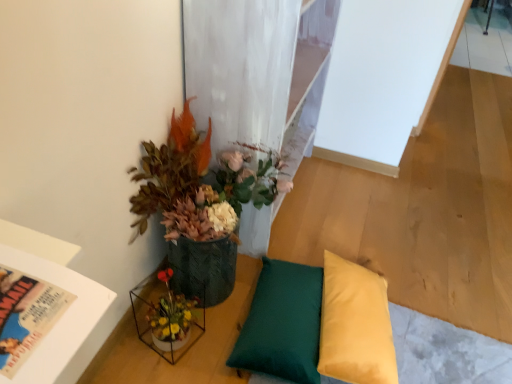
The height and width of the screenshot is (384, 512). In order to click on vacant space that is in between translucent glass vase at lower left and green fabric pillow at lower center, marked as the second pillow in a right-to-left arrangement in this screenshot , I will do `click(216, 311)`.